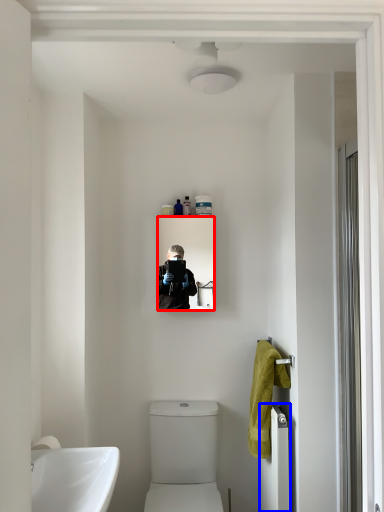
Question: Which object is closer to the camera taking this photo, mirror (highlighted by a red box) or radiator (highlighted by a blue box)?

Choices:
 (A) mirror
 (B) radiator

Answer: (B)